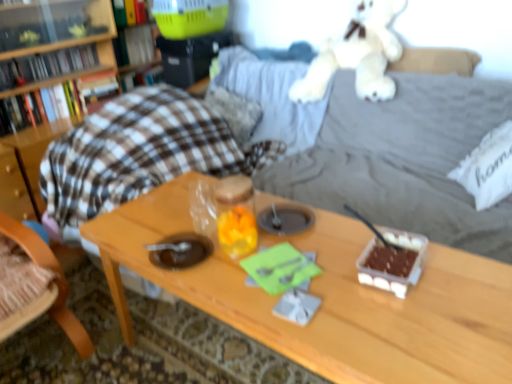
Where is `hardcover book at upper left, which ranks as the first book in top-to-bottom order`? Image resolution: width=512 pixels, height=384 pixels. hardcover book at upper left, which ranks as the first book in top-to-bottom order is located at coordinates (129, 12).

The image size is (512, 384). In order to click on white plush at upper center in this screenshot , I will do `click(357, 55)`.

This screenshot has width=512, height=384. What are the coordinates of `white fabric pillow at right` in the screenshot? It's located at click(488, 168).

The width and height of the screenshot is (512, 384). Describe the element at coordinates (488, 168) in the screenshot. I see `white fabric pillow at right` at that location.

Identify the location of hardcover book at upper left, which is counted as the fourth book, starting from the bottom. Image resolution: width=512 pixels, height=384 pixels. (129, 12).

From the picture: Considering the relative sizes of hardcover book at upper left, which is counted as the fourth book, starting from the bottom, and wooden table at center in the image provided, is hardcover book at upper left, which is counted as the fourth book, starting from the bottom, wider than wooden table at center?

No, hardcover book at upper left, which is counted as the fourth book, starting from the bottom, is not wider than wooden table at center.

Is hardcover book at upper left, which is counted as the fourth book, starting from the bottom, turned away from wooden table at center?

hardcover book at upper left, which is counted as the fourth book, starting from the bottom, is not turned away from wooden table at center.

Which of these two, hardcover book at upper left, which ranks as the first book in top-to-bottom order, or wooden table at center, is smaller?

hardcover book at upper left, which ranks as the first book in top-to-bottom order, is smaller.

From the image's perspective, is hardcover book at upper left, which is counted as the fourth book, starting from the bottom, positioned above or below wooden table at center?

From the image's perspective, hardcover book at upper left, which is counted as the fourth book, starting from the bottom, appears above wooden table at center.

From the picture: Choose the correct answer: Is hardcover book at upper left, which ranks as the first book in top-to-bottom order, inside translucent plastic container with chocolate at right or outside it?

The correct answer is: outside.

Is hardcover book at upper left, which is counted as the fourth book, starting from the bottom, oriented towards translucent plastic container with chocolate at right?

Yes, hardcover book at upper left, which is counted as the fourth book, starting from the bottom, is facing translucent plastic container with chocolate at right.

At what (x,y) coordinates should I click in order to perform the action: click on food on the right of hardcover book at upper left, which is counted as the fourth book, starting from the bottom. Please return your answer as a coordinate pair (x, y). The width and height of the screenshot is (512, 384). Looking at the image, I should click on (392, 261).

From the image's perspective, which is above, hardcover book at upper left, which is counted as the fourth book, starting from the bottom, or translucent plastic container with chocolate at right?

hardcover book at upper left, which is counted as the fourth book, starting from the bottom.

Between hardcover book at upper left, which is the second book from bottom to top, and hardcover book at left, the fourth book positioned from the top, which one has smaller size?

hardcover book at upper left, which is the second book from bottom to top, is smaller.

Considering the positions of points (35, 76) and (21, 120), is point (35, 76) farther from camera compared to point (21, 120)?

That is True.

Which object is further away from the camera, hardcover book at upper left, which is the second book from bottom to top, or hardcover book at left, the 1th book from the bottom?

Positioned behind is hardcover book at upper left, which is the second book from bottom to top.

From the image's perspective, would you say hardcover book at upper left, the 3th book positioned from the top, is positioned over hardcover book at left, the fourth book positioned from the top?

Yes, from the image's perspective, hardcover book at upper left, the 3th book positioned from the top, is over hardcover book at left, the fourth book positioned from the top.

From a real-world perspective, which is physically below, translucent plastic container with chocolate at right or green plastic book at upper center, the second book positioned from the top?

translucent plastic container with chocolate at right, from a real-world perspective.

Is translucent plastic container with chocolate at right positioned in front of green plastic book at upper center, arranged as the third book when ordered from the bottom?

Yes, it is.

Is point (378, 267) closer to viewer compared to point (144, 30)?

Yes, point (378, 267) is closer to viewer.

Can you confirm if translucent plastic container with chocolate at right is wider than green plastic book at upper center, the second book positioned from the top?

Indeed, translucent plastic container with chocolate at right has a greater width compared to green plastic book at upper center, the second book positioned from the top.

From the image's perspective, does white plush at upper center appear lower than hardcover book at left, the fourth book positioned from the top?

No.

Is white plush at upper center to the left or to the right of hardcover book at left, the 1th book from the bottom, in the image?

white plush at upper center is positioned on hardcover book at left, the 1th book from the bottom,'s right side.

Considering the points (326, 73) and (102, 72), which point is in front, point (326, 73) or point (102, 72)?

Positioned in front is point (326, 73).

Can we say white plush at upper center lies outside hardcover book at left, the 1th book from the bottom?

Yes, white plush at upper center is located beyond the bounds of hardcover book at left, the 1th book from the bottom.

Who is shorter, hardcover book at upper left, which ranks as the first book in top-to-bottom order, or hardcover book at upper left, the 3th book positioned from the top?

With less height is hardcover book at upper left, the 3th book positioned from the top.

Is hardcover book at upper left, which ranks as the first book in top-to-bottom order, located outside hardcover book at upper left, the 3th book positioned from the top?

Yes, hardcover book at upper left, which ranks as the first book in top-to-bottom order, is not within hardcover book at upper left, the 3th book positioned from the top.

Who is smaller, hardcover book at upper left, which ranks as the first book in top-to-bottom order, or hardcover book at upper left, the 3th book positioned from the top?

Smaller between the two is hardcover book at upper left, the 3th book positioned from the top.

Can you tell me how much hardcover book at upper left, which ranks as the first book in top-to-bottom order, and hardcover book at upper left, which is the second book from bottom to top, differ in facing direction?

The facing directions of hardcover book at upper left, which ranks as the first book in top-to-bottom order, and hardcover book at upper left, which is the second book from bottom to top, are 1.12 degrees apart.

Is white fabric pillow at right turned away from green plastic book at upper center, arranged as the third book when ordered from the bottom?

No, white fabric pillow at right's orientation is not away from green plastic book at upper center, arranged as the third book when ordered from the bottom.

Which object is further away from the camera, white fabric pillow at right or green plastic book at upper center, arranged as the third book when ordered from the bottom?

green plastic book at upper center, arranged as the third book when ordered from the bottom, is further away from the camera.

Locate an element on the screen. The image size is (512, 384). pillow in front of the green plastic book at upper center, arranged as the third book when ordered from the bottom is located at coordinates (488, 168).

Can you confirm if white fabric pillow at right is bigger than green plastic book at upper center, the second book positioned from the top?

Yes, white fabric pillow at right is bigger than green plastic book at upper center, the second book positioned from the top.

Where is `table on the right of hardcover book at upper left, which is counted as the fourth book, starting from the bottom`? The width and height of the screenshot is (512, 384). table on the right of hardcover book at upper left, which is counted as the fourth book, starting from the bottom is located at coordinates (329, 298).

Identify the location of food below the hardcover book at upper left, which is counted as the fourth book, starting from the bottom (from the image's perspective). This screenshot has height=384, width=512. click(392, 261).

Which object lies nearer to the anchor point hardcover book at left, the 1th book from the bottom, white fabric pillow at right or wooden chair at left?

wooden chair at left is positioned closer to the anchor hardcover book at left, the 1th book from the bottom.

Looking at this image, when comparing their distances from wooden chair at left, does hardcover book at upper left, which is the second book from bottom to top, or white fabric pillow at right seem closer?

hardcover book at upper left, which is the second book from bottom to top.

Which object lies nearer to the anchor point wooden table at center, white fabric pillow at right or translucent plastic container with chocolate at right?

Based on the image, translucent plastic container with chocolate at right appears to be nearer to wooden table at center.

Looking at this image, estimate the real-world distances between objects in this image. Which object is closer to green plastic book at upper center, arranged as the third book when ordered from the bottom, hardcover book at upper left, which ranks as the first book in top-to-bottom order, or wooden table at center?

The object closer to green plastic book at upper center, arranged as the third book when ordered from the bottom, is hardcover book at upper left, which ranks as the first book in top-to-bottom order.

When comparing their distances from white plush at upper center, does green plastic book at upper center, the second book positioned from the top, or hardcover book at left, the 1th book from the bottom, seem closer?

The object closer to white plush at upper center is green plastic book at upper center, the second book positioned from the top.

Considering their positions, is translucent plastic container with chocolate at right positioned closer to white plush at upper center than wooden table at center?

wooden table at center.

Considering their positions, is hardcover book at upper left, which ranks as the first book in top-to-bottom order, positioned further to hardcover book at left, the fourth book positioned from the top, than wooden chair at left?

Among the two, wooden chair at left is located further to hardcover book at left, the fourth book positioned from the top.

Based on their spatial positions, is green plastic book at upper center, arranged as the third book when ordered from the bottom, or wooden table at center further from wooden chair at left?

Based on the image, green plastic book at upper center, arranged as the third book when ordered from the bottom, appears to be further to wooden chair at left.

Identify the location of food between wooden table at center and green plastic book at upper center, arranged as the third book when ordered from the bottom, from front to back. The width and height of the screenshot is (512, 384). (392, 261).

Locate an element on the screen. The image size is (512, 384). teddy bear between hardcover book at upper left, which is counted as the fourth book, starting from the bottom, and white fabric pillow at right from left to right is located at coordinates 357,55.

Identify the location of book between wooden chair at left and hardcover book at upper left, the 3th book positioned from the top, from front to back. (40, 106).

Identify the location of food between white plush at upper center and wooden table at center vertically. click(392, 261).